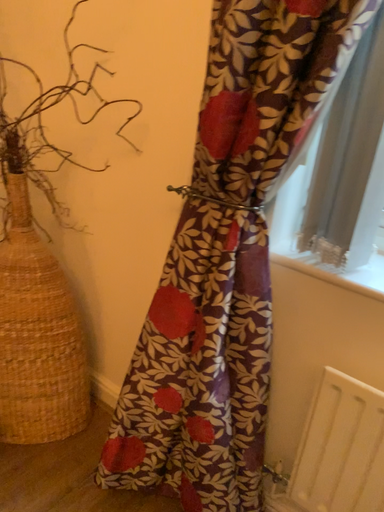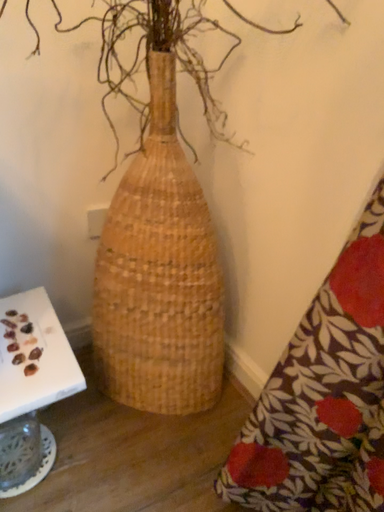
Question: Which way did the camera rotate in the video?

Choices:
 (A) rotated right
 (B) rotated left

Answer: (B)